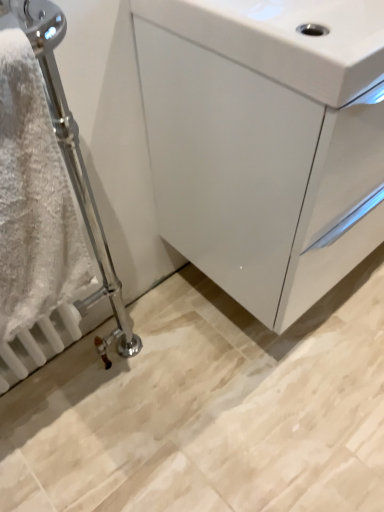
Question: Can we say white glossy cabinet at center lies outside white fluffy towel at left?

Choices:
 (A) yes
 (B) no

Answer: (A)

Question: From a real-world perspective, is white glossy cabinet at center on white fluffy towel at left?

Choices:
 (A) no
 (B) yes

Answer: (A)

Question: Considering the relative sizes of white glossy cabinet at center and white fluffy towel at left in the image provided, is white glossy cabinet at center thinner than white fluffy towel at left?

Choices:
 (A) no
 (B) yes

Answer: (A)

Question: From the image's perspective, does white glossy cabinet at center appear lower than white fluffy towel at left?

Choices:
 (A) yes
 (B) no

Answer: (B)

Question: Can you confirm if white glossy cabinet at center is taller than white fluffy towel at left?

Choices:
 (A) no
 (B) yes

Answer: (B)

Question: From the image's perspective, is white glossy cabinet at center above white fluffy towel at left?

Choices:
 (A) yes
 (B) no

Answer: (A)

Question: Considering the relative sizes of white glossy cabinet at center and white glossy sink at upper right in the image provided, is white glossy cabinet at center thinner than white glossy sink at upper right?

Choices:
 (A) no
 (B) yes

Answer: (A)

Question: Is white glossy cabinet at center facing towards white glossy sink at upper right?

Choices:
 (A) no
 (B) yes

Answer: (A)

Question: From a real-world perspective, is white glossy cabinet at center located beneath white glossy sink at upper right?

Choices:
 (A) yes
 (B) no

Answer: (A)

Question: Can you confirm if white glossy cabinet at center is wider than white glossy sink at upper right?

Choices:
 (A) no
 (B) yes

Answer: (B)

Question: Is white glossy cabinet at center bigger than white glossy sink at upper right?

Choices:
 (A) no
 (B) yes

Answer: (B)

Question: Is white glossy cabinet at center outside white glossy sink at upper right?

Choices:
 (A) no
 (B) yes

Answer: (B)

Question: Is white fluffy towel at left outside of white glossy cabinet at center?

Choices:
 (A) yes
 (B) no

Answer: (A)